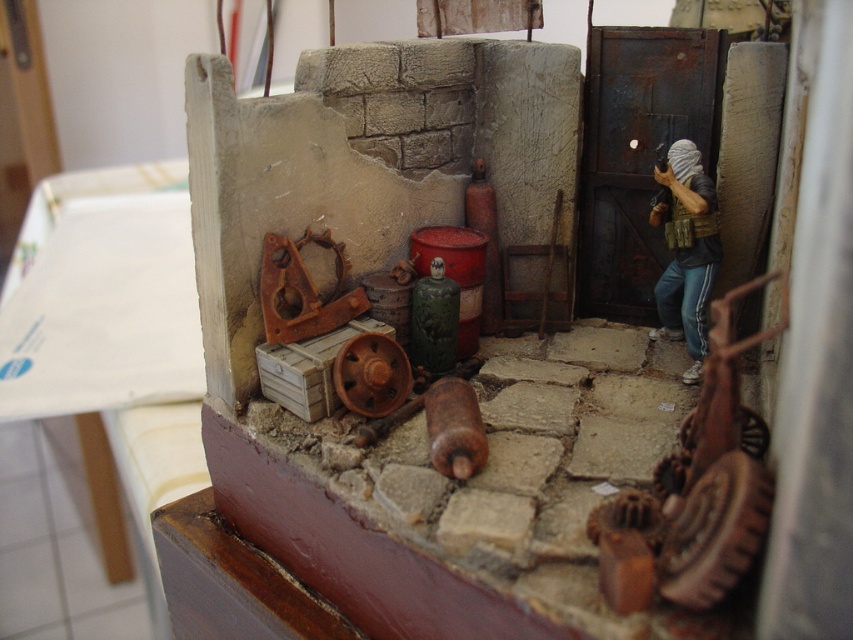
Does wooden gear at lower right appear on the right side of camouflage fabric figure at right?

No, wooden gear at lower right is not to the right of camouflage fabric figure at right.

Which is behind, point (695, 548) or point (695, 378)?

The point (695, 378) is more distant.

Between point (749, 417) and point (688, 348), which one is positioned in front?

Point (749, 417) is more forward.

Locate an element on the screen. This screenshot has height=640, width=853. wooden gear at lower right is located at coordinates (697, 488).